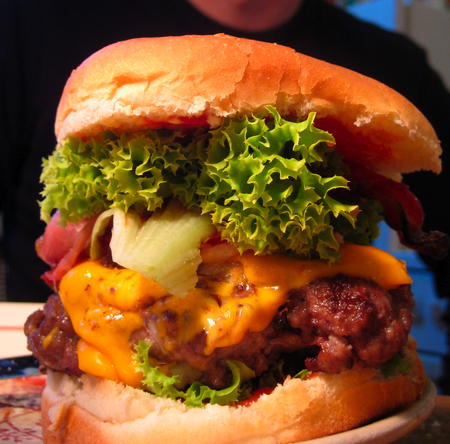
Where is `plate`? Image resolution: width=450 pixels, height=444 pixels. plate is located at coordinates [390, 428], [11, 372].